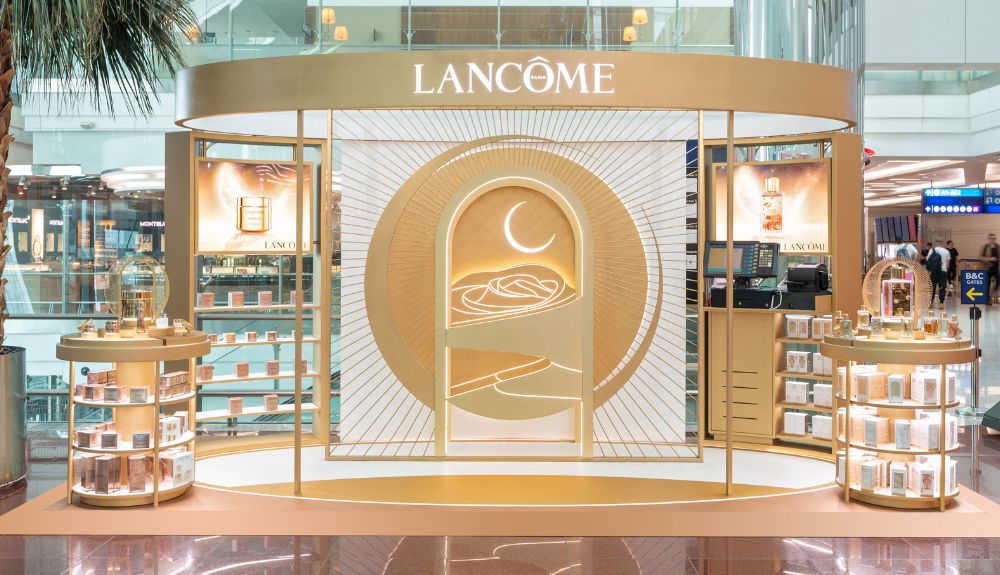
Identify the location of display cases. (156, 391), (906, 420).